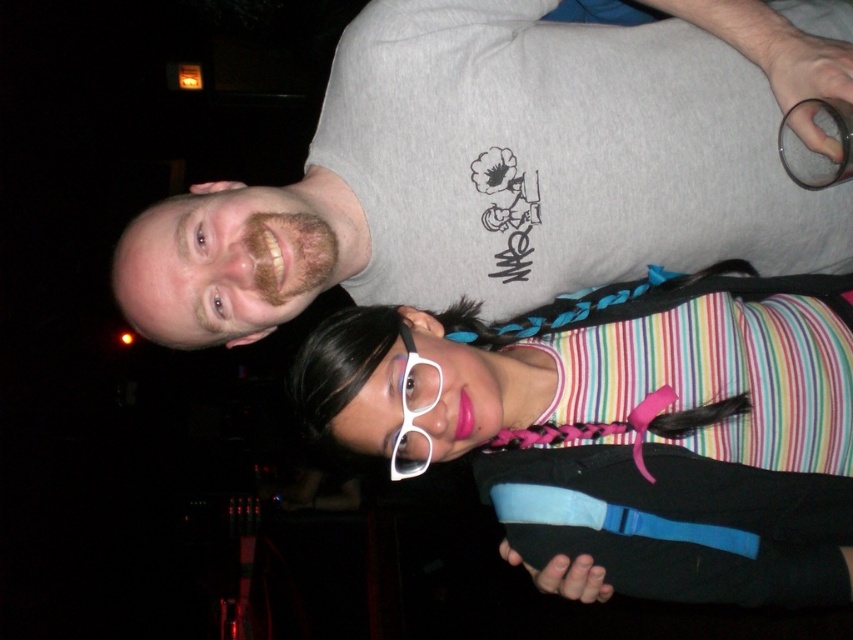
Can you confirm if gray cotton t-shirt at upper center is thinner than white plastic glasses at center?

In fact, gray cotton t-shirt at upper center might be wider than white plastic glasses at center.

Does point (234, 196) lie behind point (428, 452)?

Yes, it is.

Measure the distance between point [354,76] and camera.

4.01 feet

Find the location of a particular element. This screenshot has height=640, width=853. gray cotton t-shirt at upper center is located at coordinates (512, 164).

Does point (514, 49) lie behind point (527, 419)?

No, (514, 49) is closer to viewer.

Between gray cotton t-shirt at upper center and matte striped tank top at center, which one has less height?

Standing shorter between the two is matte striped tank top at center.

Find the location of a particular element. This screenshot has height=640, width=853. gray cotton t-shirt at upper center is located at coordinates (512, 164).

Does matte striped tank top at center have a lesser width compared to white plastic glasses at center?

No.

Who is more forward, (763, 369) or (431, 365)?

Positioned in front is point (431, 365).

Where is `matte striped tank top at center`? Image resolution: width=853 pixels, height=640 pixels. matte striped tank top at center is located at coordinates (624, 428).